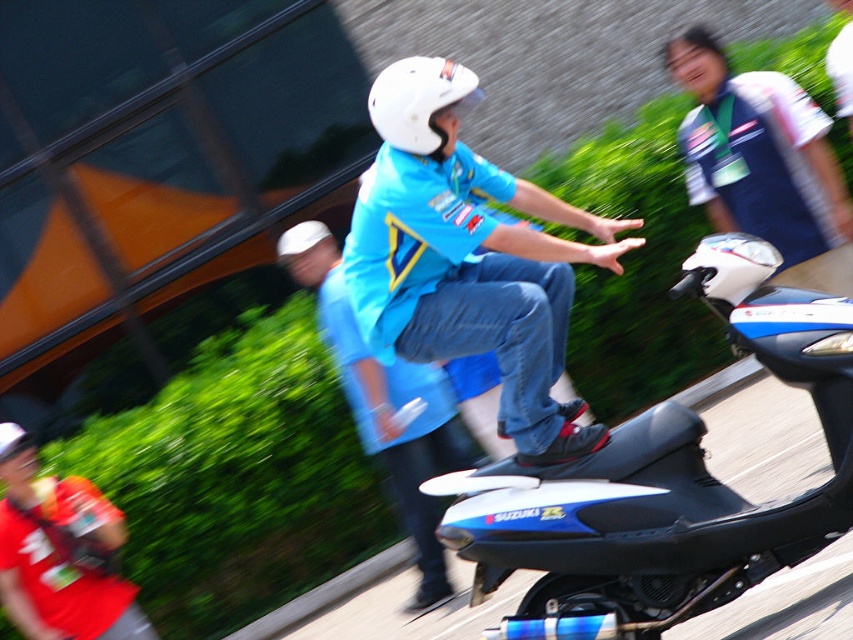
Question: Which point appears closest to the camera in this image?

Choices:
 (A) (755, 81)
 (B) (520, 369)
 (C) (585, 538)

Answer: (B)

Question: Is blue glossy scooter at center smaller than blue fabric shirt at center?

Choices:
 (A) yes
 (B) no

Answer: (A)

Question: Among these points, which one is farthest from the camera?

Choices:
 (A) (509, 506)
 (B) (485, 218)
 (C) (376, 120)
 (D) (427, 518)

Answer: (D)

Question: Can you confirm if blue matte shirt at center is smaller than white jersey at upper right?

Choices:
 (A) yes
 (B) no

Answer: (A)

Question: Which object is positioned farthest from the blue glossy scooter at center?

Choices:
 (A) white matte helmet at center
 (B) white jersey at upper right

Answer: (B)

Question: Can you confirm if blue glossy scooter at center is smaller than blue fabric shirt at center?

Choices:
 (A) yes
 (B) no

Answer: (A)